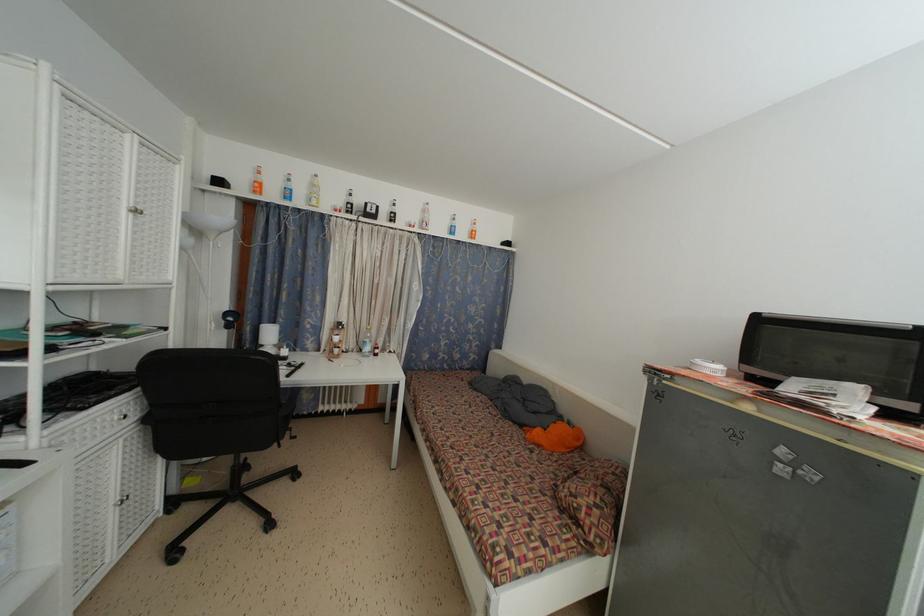
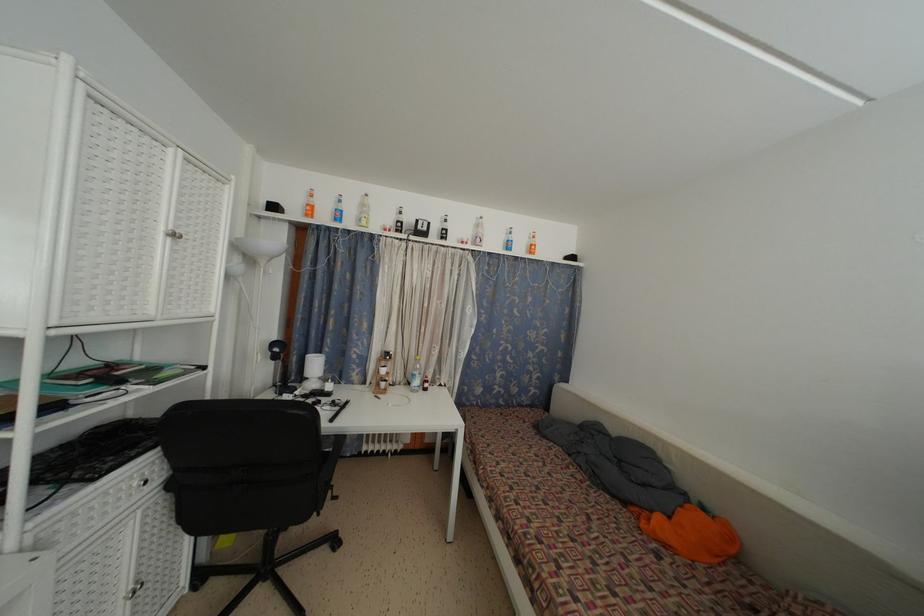
In the second image, find the point that corresponds to pixel 319 192 in the first image.

(368, 213)